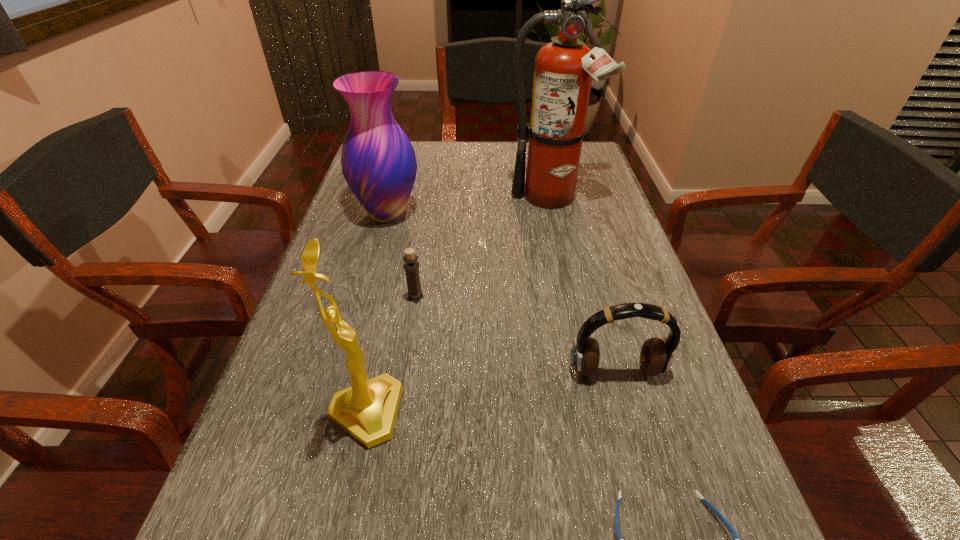
At what (x,y) coordinates should I click in order to perform the action: click on free location that satisfies the following two spatial constraints: 1. on the front side of the fourth nearest object; 2. on the right side of the vase. Please return your answer as a coordinate pair (x, y). The height and width of the screenshot is (540, 960). Looking at the image, I should click on (365, 298).

Locate an element on the screen. free space that satisfies the following two spatial constraints: 1. on the ear cup of the headset; 2. on the front-facing side of the award is located at coordinates (628, 413).

Where is `vacant region that satisfies the following two spatial constraints: 1. on the ear cup of the headset; 2. on the front-facing side of the award`? vacant region that satisfies the following two spatial constraints: 1. on the ear cup of the headset; 2. on the front-facing side of the award is located at coordinates (628, 413).

I want to click on free region that satisfies the following two spatial constraints: 1. from the nozzle of the fire extinguisher; 2. on the front-facing side of the award, so click(x=596, y=413).